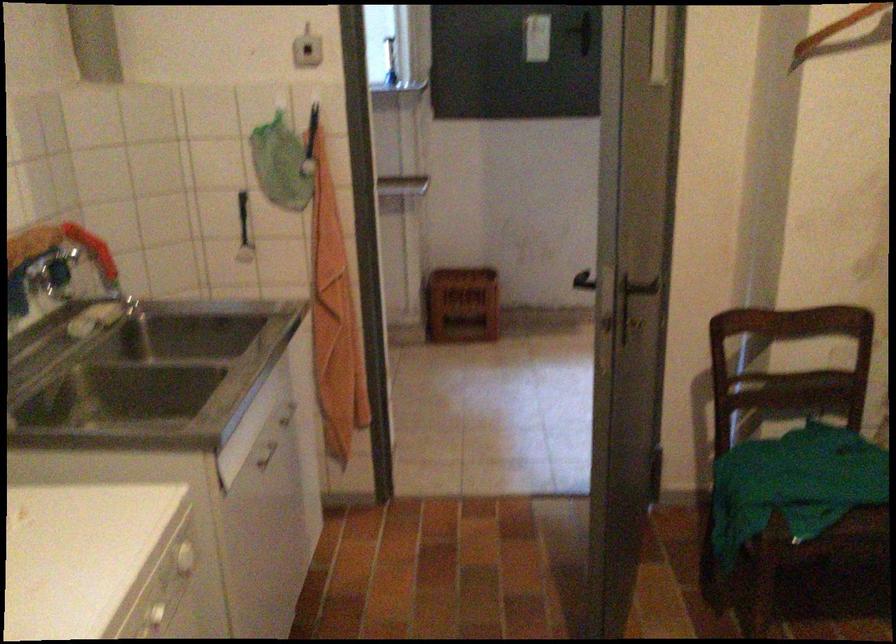
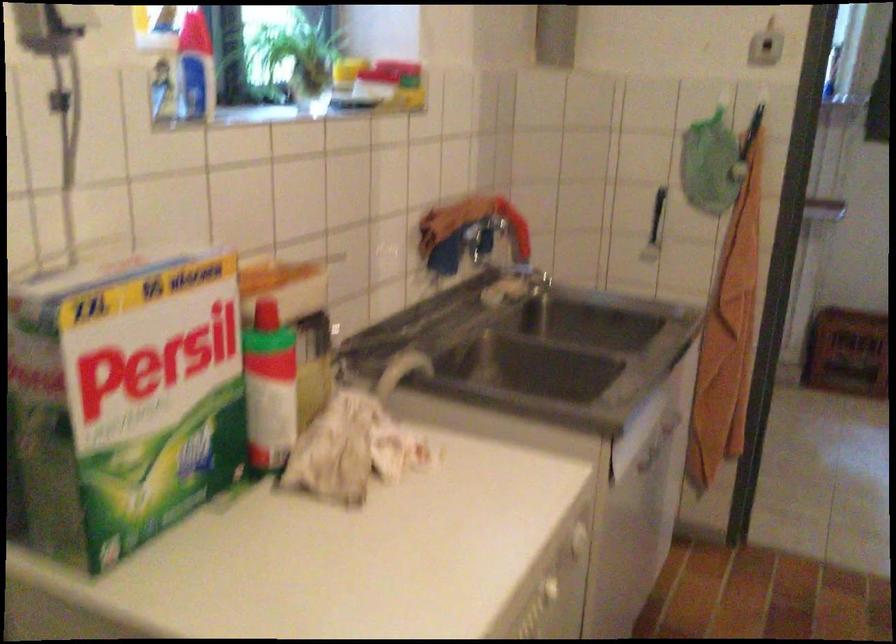
Question: Which direction would the cameraman need to move to produce the second image? Reply with the corresponding letter.

Choices:
 (A) Left
 (B) Right
 (C) Forward
 (D) Backward

Answer: (A)